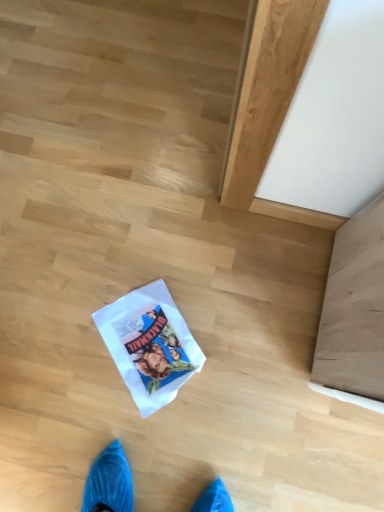
The height and width of the screenshot is (512, 384). In order to click on free space on the front side of white paper comic book at center in this screenshot , I will do `click(160, 437)`.